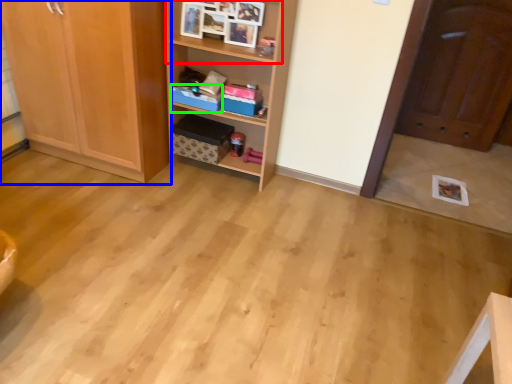
Question: Estimate the real-world distances between objects in this image. Which object is closer to cabinet (highlighted by a red box), cabinetry (highlighted by a blue box) or storage box (highlighted by a green box)?

Choices:
 (A) cabinetry
 (B) storage box

Answer: (B)